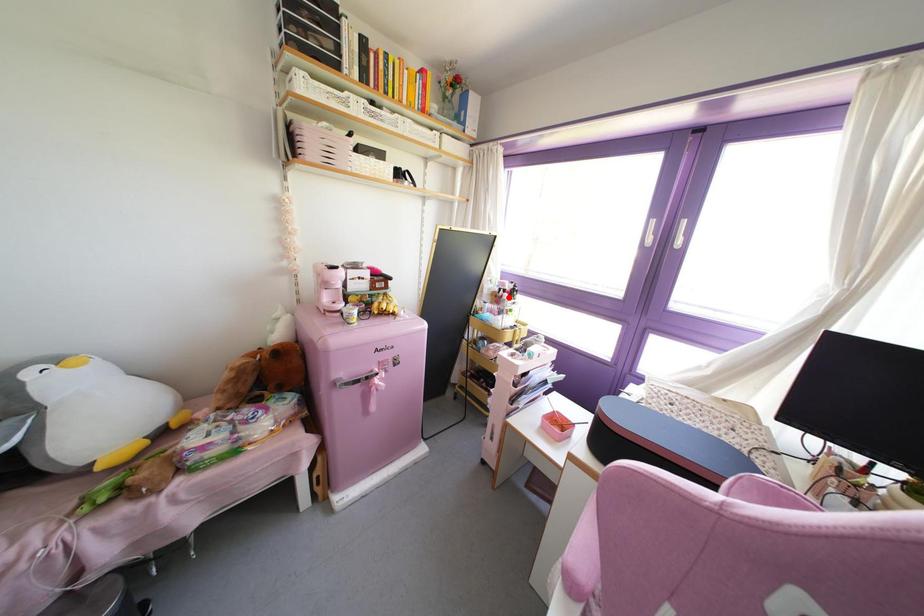
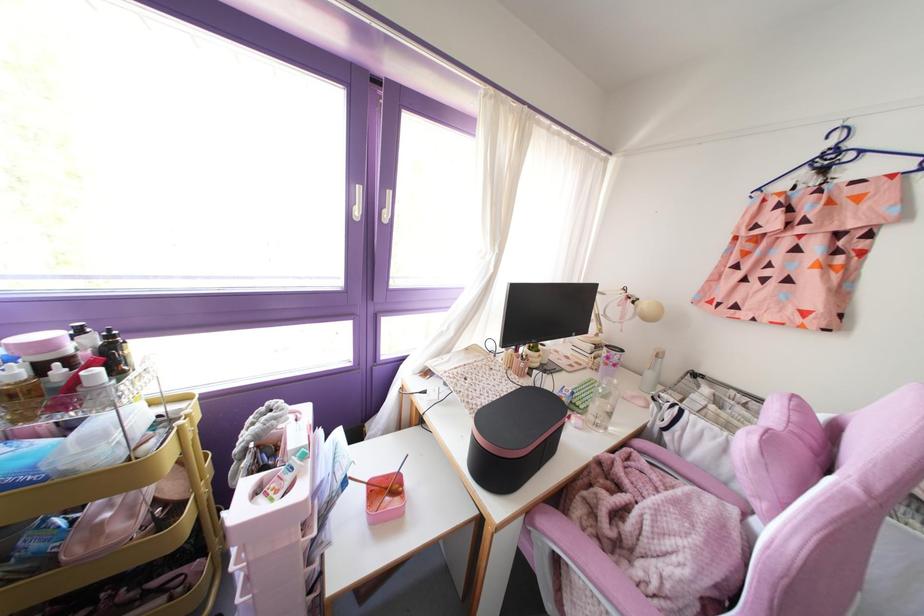
Question: I am providing you with two images of the same scene from different viewpoints. A red point is marked on the first image. At the location where the point appears in image 1, is it still visible in image 2?

Choices:
 (A) Yes
 (B) No

Answer: (A)